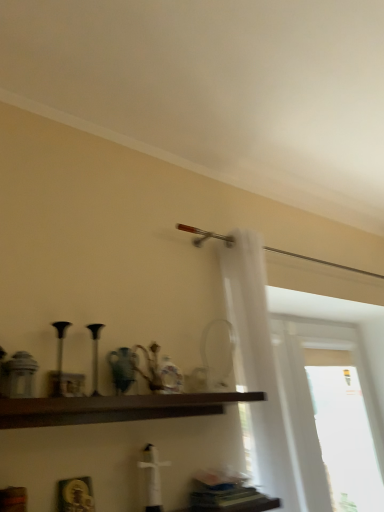
Question: Is transparent glass window at right positioned before dark brown wood shelf at center?

Choices:
 (A) no
 (B) yes

Answer: (A)

Question: Could you tell me if transparent glass window at right is turned towards dark brown wood shelf at center?

Choices:
 (A) yes
 (B) no

Answer: (B)

Question: Is transparent glass window at right not within dark brown wood shelf at center?

Choices:
 (A) yes
 (B) no

Answer: (A)

Question: Can you confirm if transparent glass window at right is wider than dark brown wood shelf at center?

Choices:
 (A) no
 (B) yes

Answer: (A)

Question: From the image's perspective, would you say transparent glass window at right is shown under dark brown wood shelf at center?

Choices:
 (A) yes
 (B) no

Answer: (A)

Question: Is dark brown wood shelf at center in front of or behind white sheer curtain at right in the image?

Choices:
 (A) behind
 (B) front

Answer: (B)

Question: From a real-world perspective, relative to white sheer curtain at right, is dark brown wood shelf at center vertically above or below?

Choices:
 (A) below
 (B) above

Answer: (A)

Question: Is dark brown wood shelf at center taller or shorter than white sheer curtain at right?

Choices:
 (A) short
 (B) tall

Answer: (A)

Question: Considering the positions of dark brown wood shelf at center and white sheer curtain at right in the image, is dark brown wood shelf at center bigger or smaller than white sheer curtain at right?

Choices:
 (A) small
 (B) big

Answer: (A)

Question: Does point (246, 261) appear closer or farther from the camera than point (14, 422)?

Choices:
 (A) closer
 (B) farther

Answer: (B)

Question: Considering the positions of white sheer curtain at right and dark brown wood shelf at center in the image, is white sheer curtain at right taller or shorter than dark brown wood shelf at center?

Choices:
 (A) tall
 (B) short

Answer: (A)

Question: From the image's perspective, is white sheer curtain at right positioned above or below dark brown wood shelf at center?

Choices:
 (A) below
 (B) above

Answer: (B)

Question: Based on their sizes in the image, would you say white sheer curtain at right is bigger or smaller than dark brown wood shelf at center?

Choices:
 (A) small
 (B) big

Answer: (B)

Question: Based on their sizes in the image, would you say dark brown wood shelf at center is bigger or smaller than transparent glass window at right?

Choices:
 (A) big
 (B) small

Answer: (B)

Question: In terms of height, does dark brown wood shelf at center look taller or shorter compared to transparent glass window at right?

Choices:
 (A) short
 (B) tall

Answer: (A)